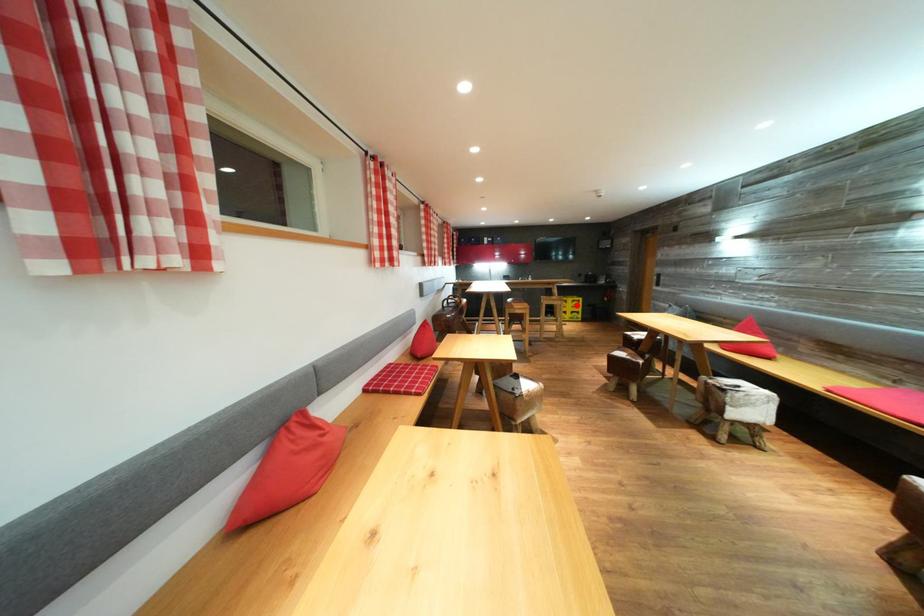
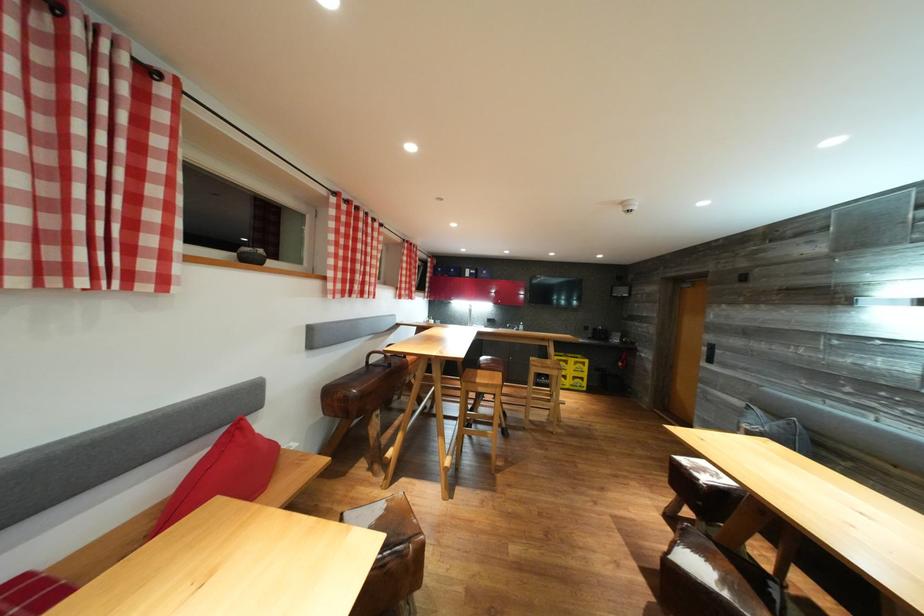
In the second image, find the point that corresponds to the highlighted location in the first image.

(578, 366)